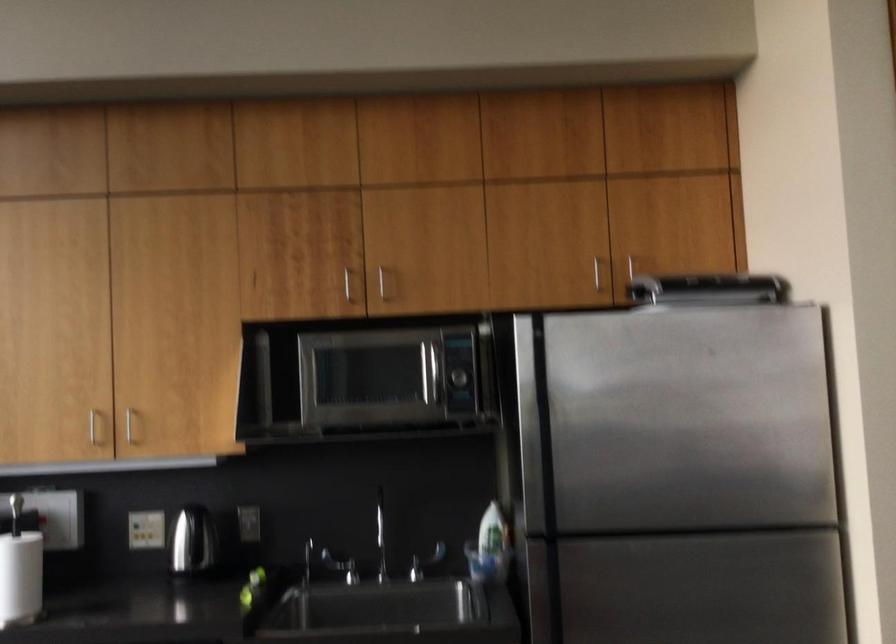
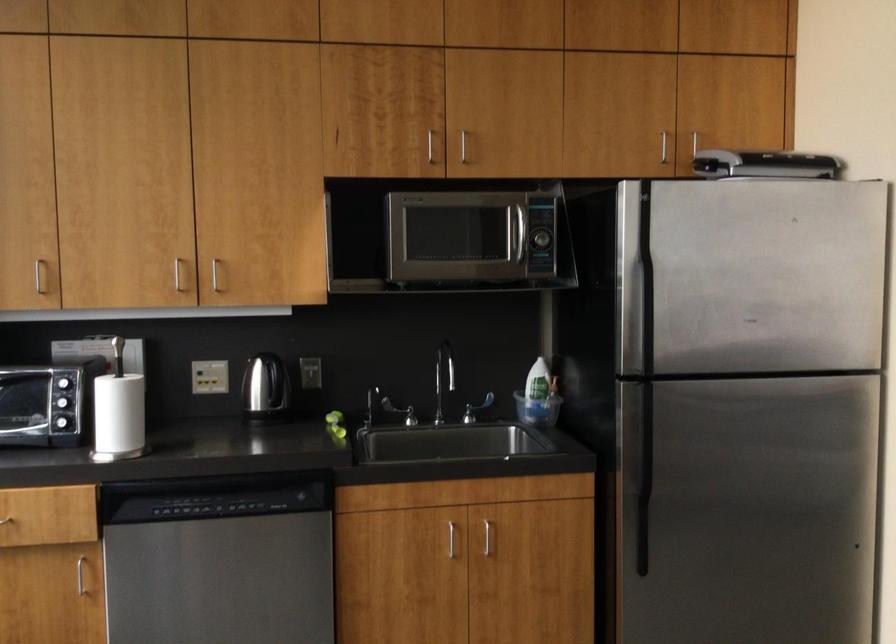
Question: The first image is from the beginning of the video and the second image is from the end. How did the camera likely rotate when shooting the video?

Choices:
 (A) Left
 (B) Right
 (C) Up
 (D) Down

Answer: (D)